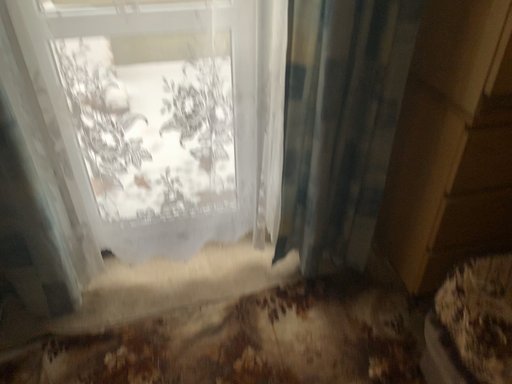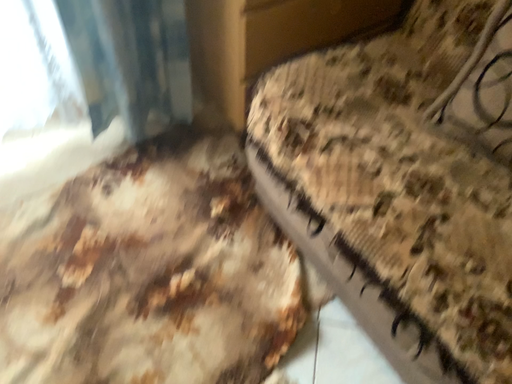
Question: How did the camera likely rotate when shooting the video?

Choices:
 (A) rotated upward
 (B) rotated downward

Answer: (B)